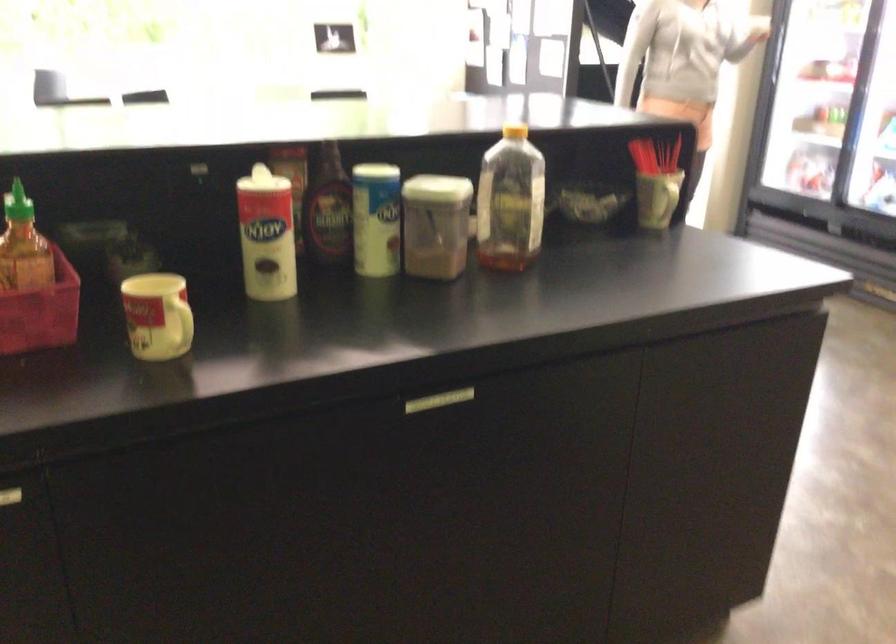
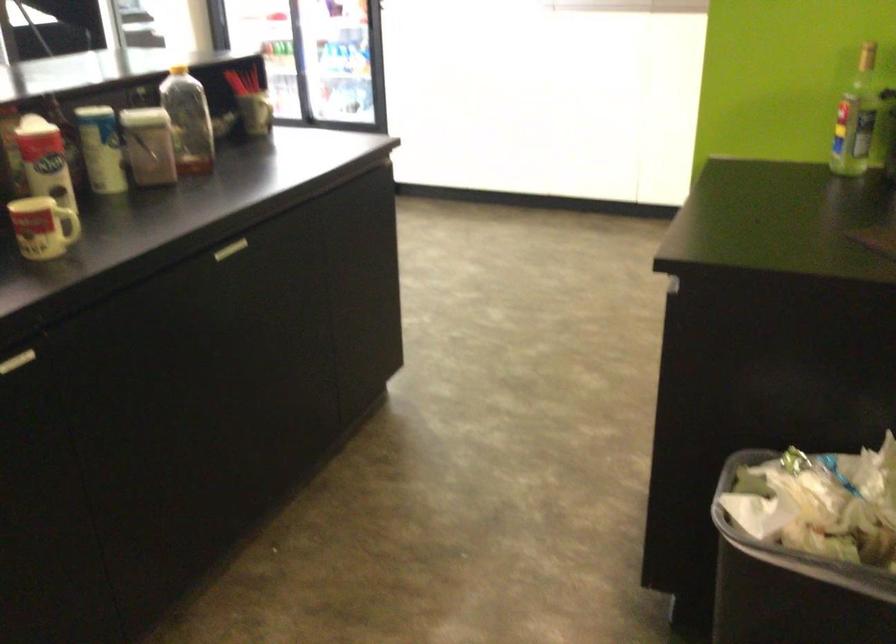
In the second image, find the point that corresponds to point 352,212 in the first image.

(100, 149)